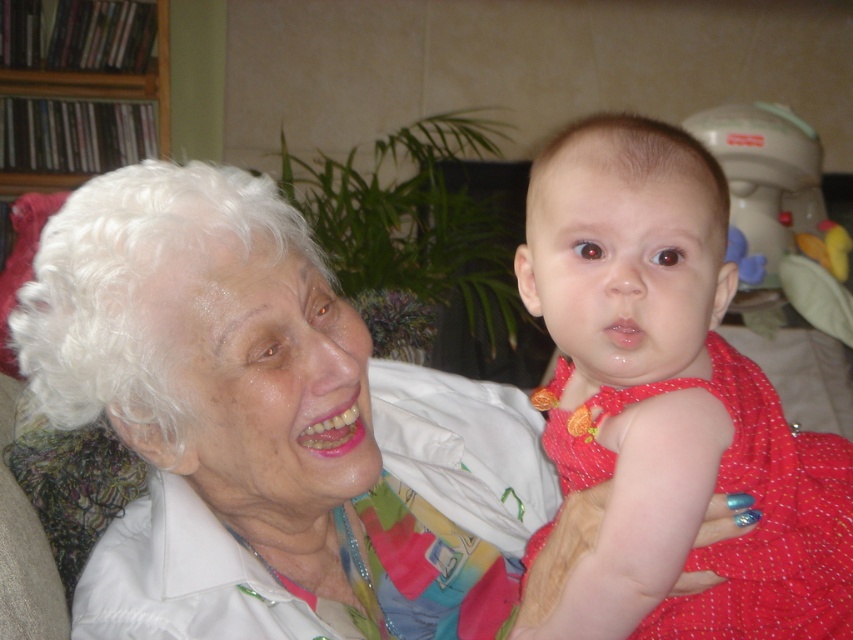
How much distance is there between white matte hair at upper left and matte red dress at center?

white matte hair at upper left is 7.95 inches from matte red dress at center.

Does white matte hair at upper left appear on the left side of matte red dress at center?

Indeed, white matte hair at upper left is positioned on the left side of matte red dress at center.

Identify the location of white matte hair at upper left. (262, 426).

I want to click on white matte hair at upper left, so click(262, 426).